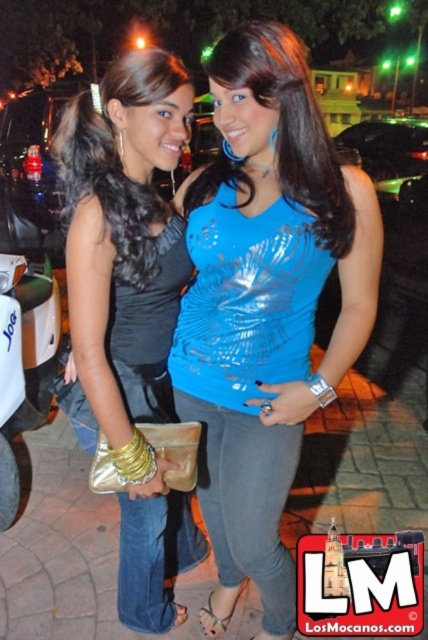
Question: Which of the following is the farthest from the observer?

Choices:
 (A) white matte scooter at lower left
 (B) shiny blue tank top at center
 (C) shiny blue top at center
 (D) matte black dress at center

Answer: (A)

Question: Can you confirm if shiny blue tank top at center is thinner than white matte scooter at lower left?

Choices:
 (A) no
 (B) yes

Answer: (A)

Question: Among these objects, which one is farthest from the camera?

Choices:
 (A) white matte scooter at lower left
 (B) shiny blue top at center

Answer: (A)

Question: Can you confirm if shiny blue top at center is thinner than white matte scooter at lower left?

Choices:
 (A) no
 (B) yes

Answer: (A)

Question: Is matte black dress at center further to camera compared to white matte scooter at lower left?

Choices:
 (A) yes
 (B) no

Answer: (B)

Question: Which object is the farthest from the shiny blue top at center?

Choices:
 (A) white matte scooter at lower left
 (B) shiny blue tank top at center
 (C) matte black dress at center

Answer: (A)